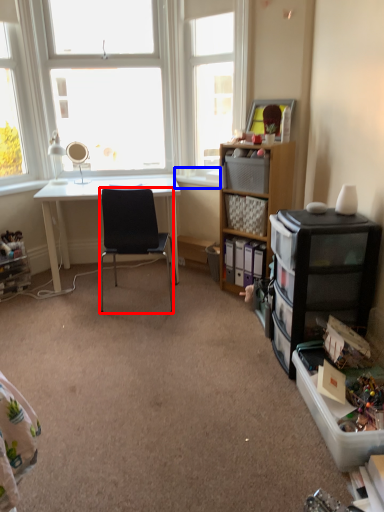
Question: Which of the following is the closest to the observer, chair (highlighted by a red box) or window sill (highlighted by a blue box)?

Choices:
 (A) chair
 (B) window sill

Answer: (A)